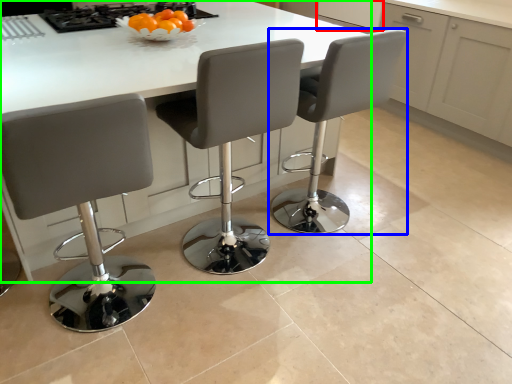
Question: Which object is positioned closest to cabinetry (highlighted by a red box)? Select from chair (highlighted by a blue box) and kitchen & dining room table (highlighted by a green box).

Choices:
 (A) chair
 (B) kitchen & dining room table

Answer: (A)